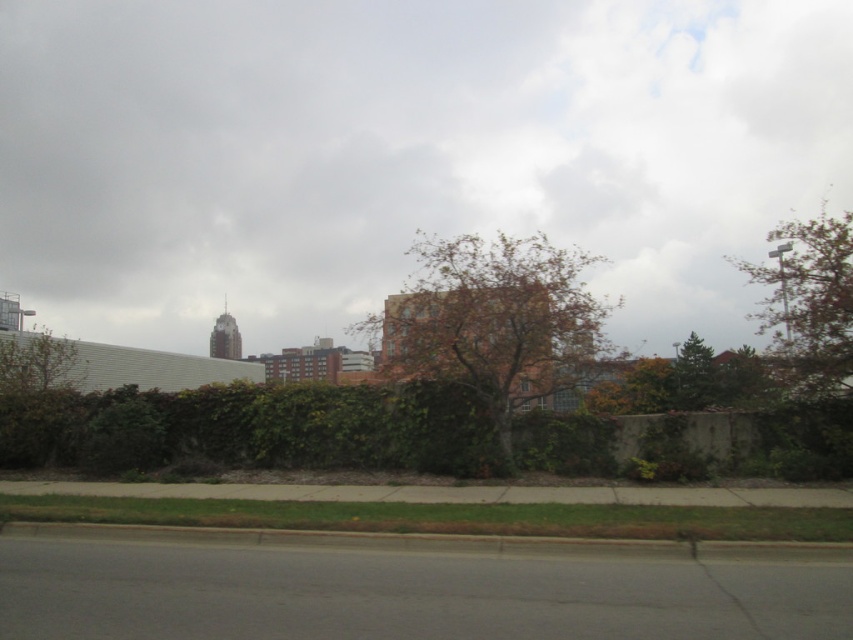
Question: Considering the relative positions of brown textured tree at upper right and green leafy tree at center in the image provided, where is brown textured tree at upper right located with respect to green leafy tree at center?

Choices:
 (A) right
 (B) left

Answer: (A)

Question: Does green leafy tree at left have a greater width compared to green leafy tree at center?

Choices:
 (A) yes
 (B) no

Answer: (B)

Question: Which point is farther to the camera?

Choices:
 (A) (721, 230)
 (B) (22, 348)
 (C) (804, 349)
 (D) (521, 353)

Answer: (A)

Question: Which of the following is the farthest from the observer?

Choices:
 (A) brown textured tree at upper right
 (B) green leafy tree at left
 (C) green leafy hedge at lower center
 (D) brown textured tree at center

Answer: (B)

Question: Which object is the closest to the brown textured tree at upper right?

Choices:
 (A) cloudy sky at upper center
 (B) green leafy tree at left

Answer: (B)

Question: Can you confirm if green leafy tree at left is bigger than green leafy tree at center?

Choices:
 (A) yes
 (B) no

Answer: (B)